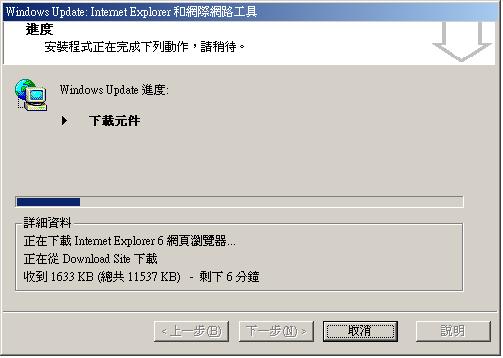
Locate an element on the screen. Image resolution: width=503 pixels, height=358 pixels. computer is located at coordinates (36, 99).